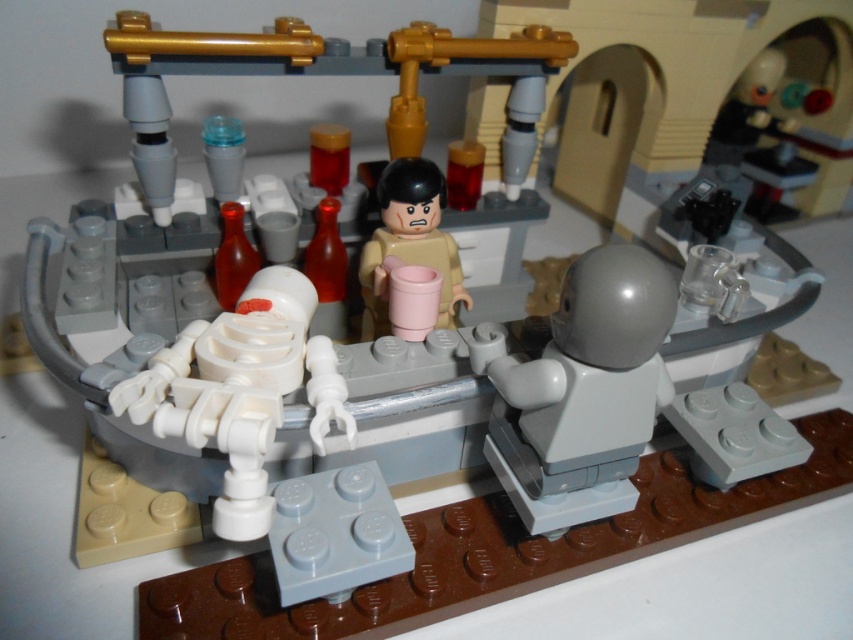
Question: Among these points, which one is farthest from the camera?

Choices:
 (A) (611, 502)
 (B) (415, 200)

Answer: (B)

Question: Does gray matte astronaut helmet at center have a smaller size compared to tan matte cup at center?

Choices:
 (A) no
 (B) yes

Answer: (A)

Question: Which of the following is the farthest from the observer?

Choices:
 (A) tan matte cup at center
 (B) gray matte astronaut helmet at center

Answer: (A)

Question: Can you confirm if gray matte astronaut helmet at center is positioned to the right of tan matte cup at center?

Choices:
 (A) yes
 (B) no

Answer: (A)

Question: Does gray matte astronaut helmet at center appear on the left side of tan matte cup at center?

Choices:
 (A) yes
 (B) no

Answer: (B)